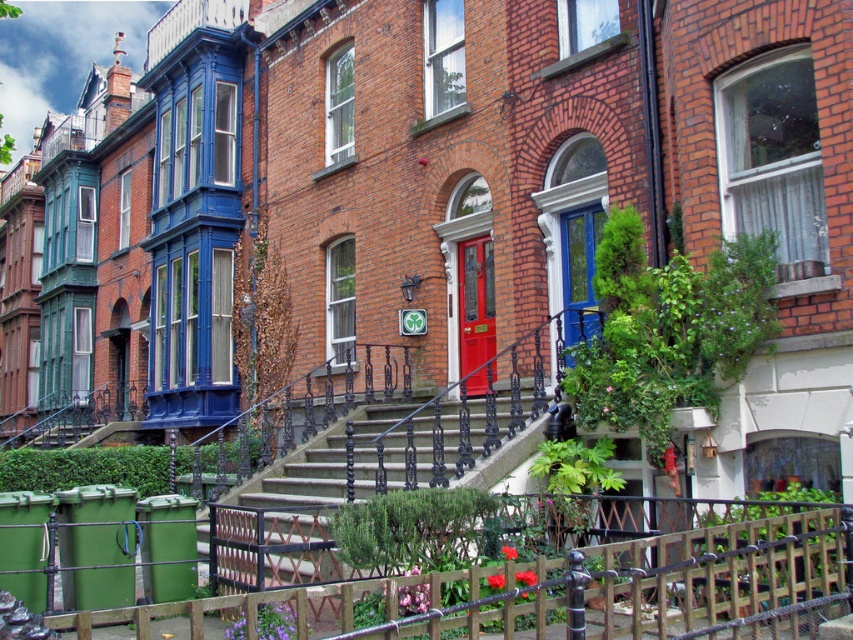
Question: Which of these objects is positioned farthest from the red glossy door at center?

Choices:
 (A) wooden fence at lower center
 (B) matte blue door at center

Answer: (A)

Question: Can you confirm if red glossy door at center is smaller than matte blue door at center?

Choices:
 (A) yes
 (B) no

Answer: (B)

Question: Is smooth concrete stairs at center bigger than red glossy door at center?

Choices:
 (A) yes
 (B) no

Answer: (B)

Question: Does red glossy door at center have a greater width compared to matte blue door at center?

Choices:
 (A) yes
 (B) no

Answer: (B)

Question: Which of the following is the farthest from the observer?

Choices:
 (A) smooth concrete stairs at center
 (B) wooden fence at lower center
 (C) red glossy door at center

Answer: (C)

Question: Considering the real-world distances, which object is farthest from the wooden fence at lower center?

Choices:
 (A) matte blue door at center
 (B) red glossy door at center
 (C) smooth concrete stairs at center

Answer: (B)